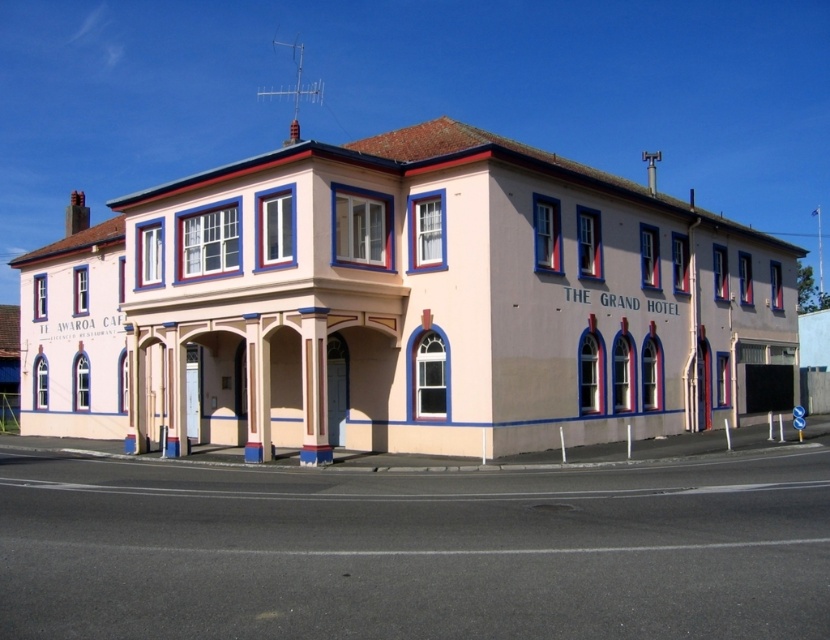
Looking at this image, is blue painted wood trim at upper center thinner than smooth cream-colored column at center?

No, blue painted wood trim at upper center is not thinner than smooth cream-colored column at center.

Does blue painted wood trim at upper center have a smaller size compared to smooth cream-colored column at center?

Incorrect, blue painted wood trim at upper center is not smaller in size than smooth cream-colored column at center.

Measure the distance between point (x=440, y=150) and camera.

Point (x=440, y=150) and camera are 24.45 meters apart from each other.

What are the coordinates of `blue painted wood trim at upper center` in the screenshot? It's located at (445, 300).